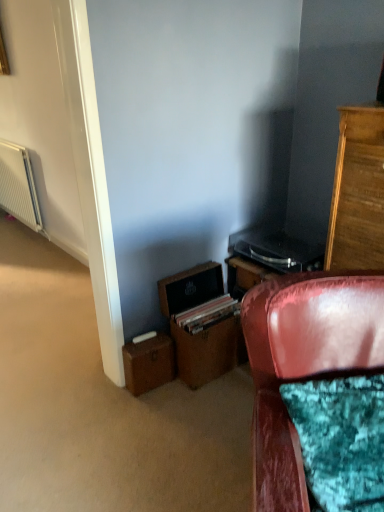
Where is `free space in front of brown cardboard box at lower left`? free space in front of brown cardboard box at lower left is located at coordinates (145, 412).